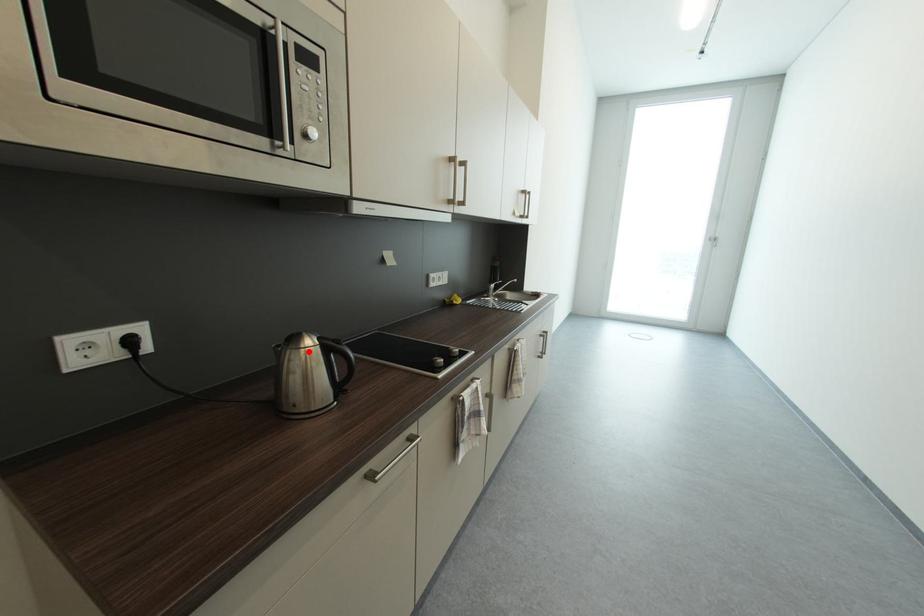
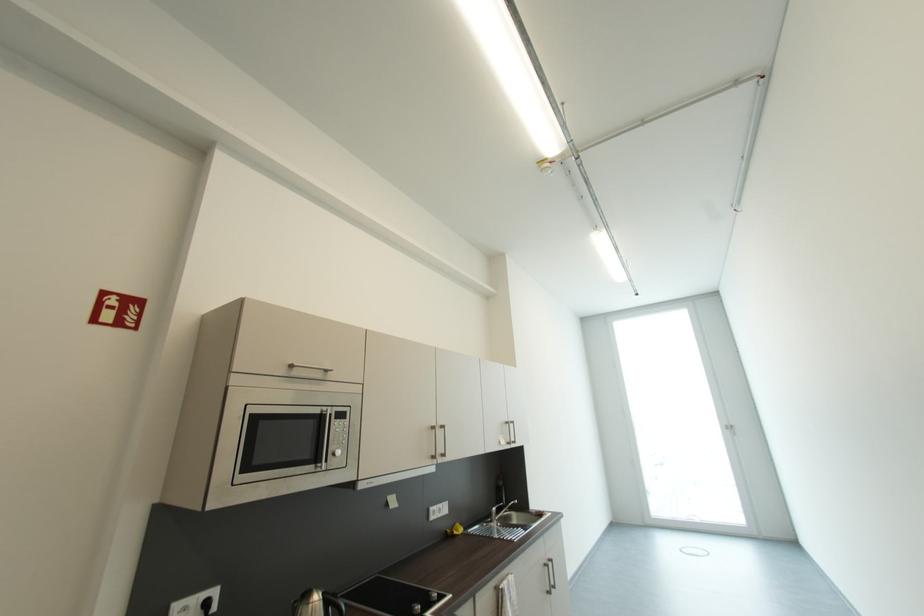
Where in the second image is the point corresponding to the highlighted location from the first image?

(317, 607)